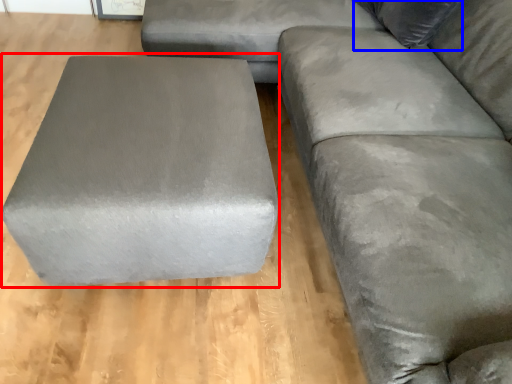
Question: Among these objects, which one is farthest to the camera, stool (highlighted by a red box) or pillow (highlighted by a blue box)?

Choices:
 (A) stool
 (B) pillow

Answer: (B)